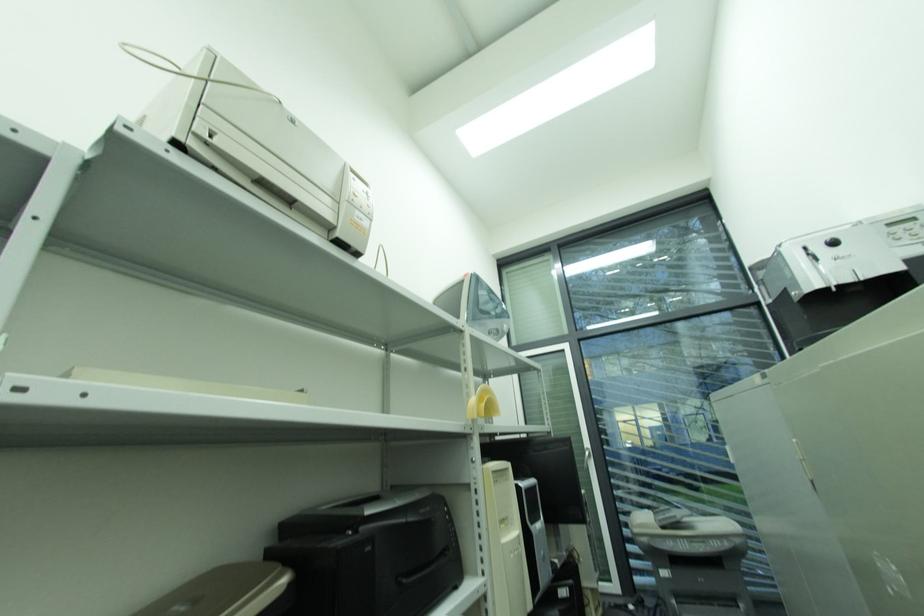
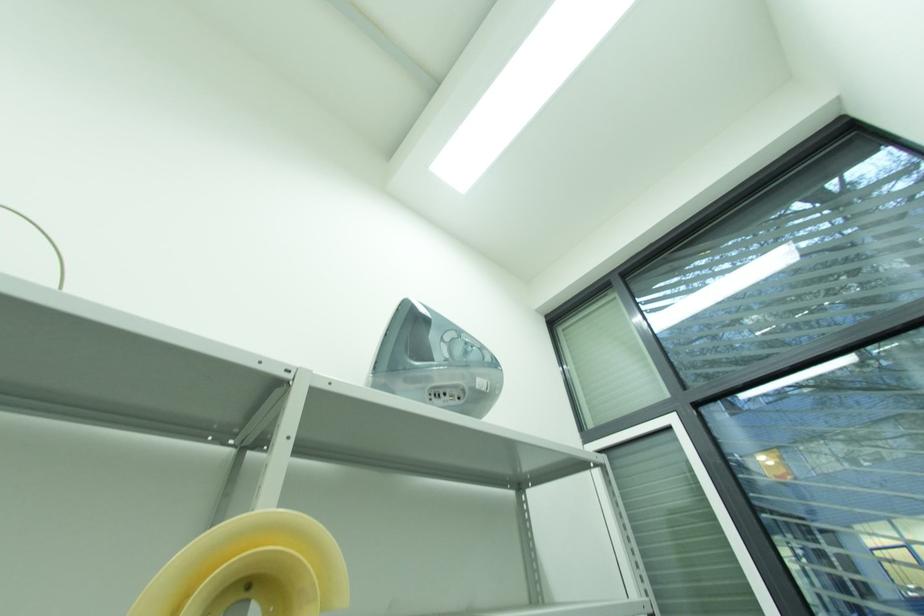
In a continuous first-person perspective shot, in which direction is the camera moving?

The movement direction of the cameraman is right, forward.